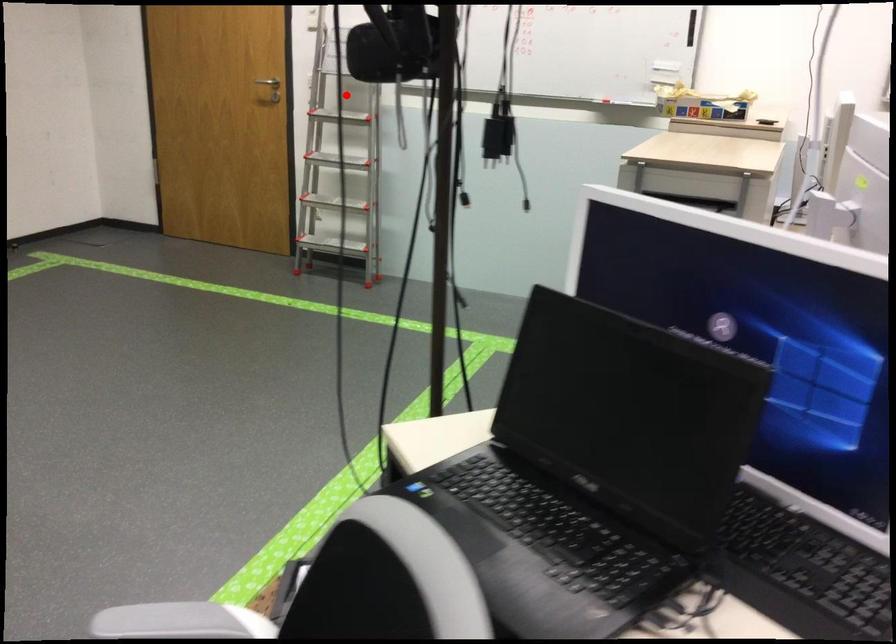
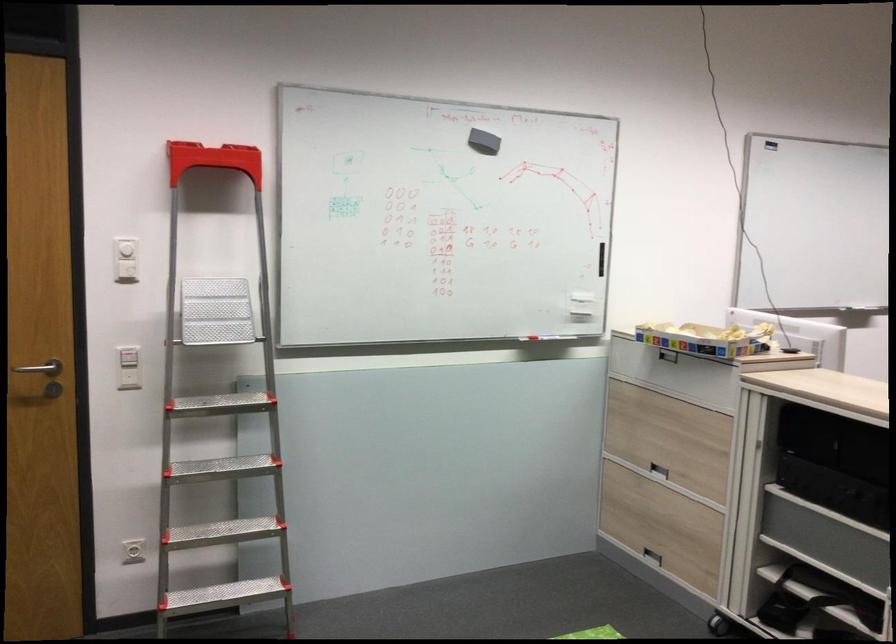
Question: A red point is marked in image1. In image2, is the corresponding 3D point closer to the camera or farther? Reply with the corresponding letter.

Choices:
 (A) The corresponding 3D point is closer.
 (B) The corresponding 3D point is farther.

Answer: (A)